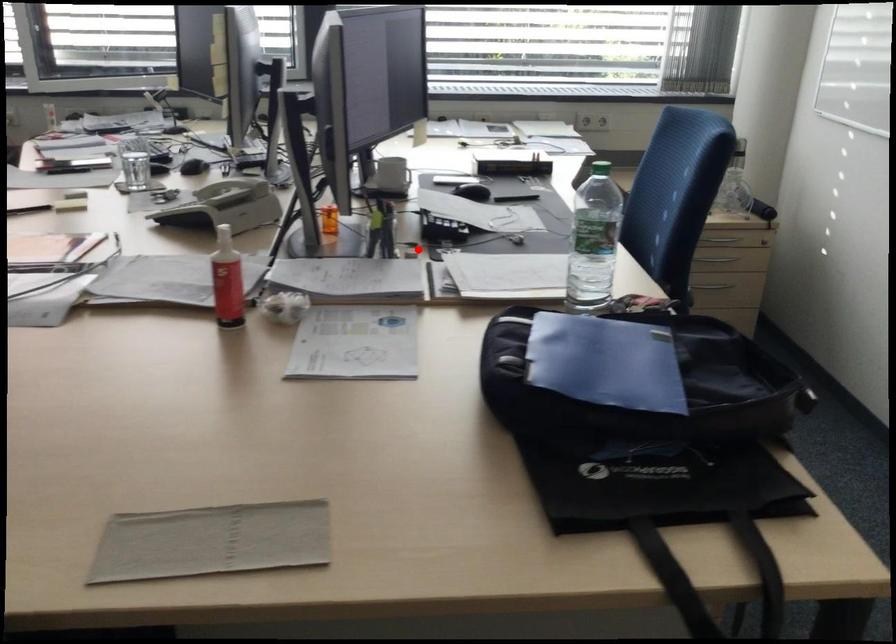
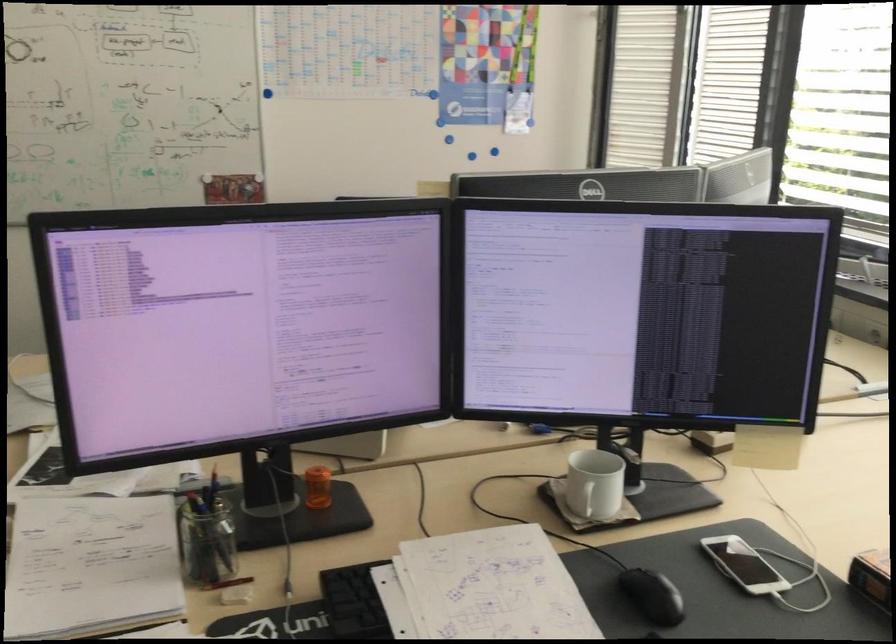
Question: I am providing you with two images of the same scene from different viewpoints. Given a red point in image1, look at the same physical point in image2. Is it:

Choices:
 (A) Closer to the viewpoint
 (B) Farther from the viewpoint

Answer: (A)